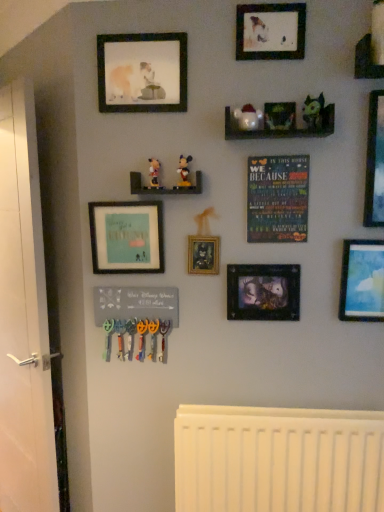
Question: Does matte blue sky at right, which ranks as the sixth picture frame in left-to-right order, turn towards wooden shelf at upper right, the 3th shelf when ordered from left to right?

Choices:
 (A) no
 (B) yes

Answer: (A)

Question: From a real-world perspective, is matte blue sky at right, which ranks as the sixth picture frame in left-to-right order, below wooden shelf at upper right, the 1th shelf viewed from the top?

Choices:
 (A) no
 (B) yes

Answer: (B)

Question: Is matte blue sky at right, which ranks as the sixth picture frame in left-to-right order, shorter than wooden shelf at upper right, the third shelf positioned from the bottom?

Choices:
 (A) yes
 (B) no

Answer: (B)

Question: Does matte blue sky at right, which ranks as the sixth picture frame in left-to-right order, have a greater height compared to wooden shelf at upper right, which is counted as the 1th shelf, starting from the right?

Choices:
 (A) no
 (B) yes

Answer: (B)

Question: Considering the relative sizes of matte blue sky at right, which ranks as the 2th picture frame in right-to-left order, and wooden shelf at upper right, the 3th shelf when ordered from left to right, in the image provided, is matte blue sky at right, which ranks as the 2th picture frame in right-to-left order, wider than wooden shelf at upper right, the 3th shelf when ordered from left to right,?

Choices:
 (A) yes
 (B) no

Answer: (B)

Question: Looking at their shapes, would you say white plastic radiator at lower center is wider or thinner than matte plastic mickey mouse at center, marked as the 1th toy in a left-to-right arrangement?

Choices:
 (A) thin
 (B) wide

Answer: (B)

Question: In the image, is white plastic radiator at lower center positioned in front of or behind matte plastic mickey mouse at center, marked as the 1th toy in a left-to-right arrangement?

Choices:
 (A) front
 (B) behind

Answer: (B)

Question: In terms of size, does white plastic radiator at lower center appear bigger or smaller than matte plastic mickey mouse at center, marked as the 1th toy in a left-to-right arrangement?

Choices:
 (A) small
 (B) big

Answer: (B)

Question: From their relative heights in the image, would you say white plastic radiator at lower center is taller or shorter than matte plastic mickey mouse at center, the fourth toy from the right?

Choices:
 (A) short
 (B) tall

Answer: (B)

Question: Considering the positions of wooden shelf at upper right, the 3th shelf when ordered from left to right, and white plastic radiator at lower center in the image, is wooden shelf at upper right, the 3th shelf when ordered from left to right, wider or thinner than white plastic radiator at lower center?

Choices:
 (A) wide
 (B) thin

Answer: (B)

Question: Considering the positions of point (377, 66) and point (347, 444), is point (377, 66) closer or farther from the camera than point (347, 444)?

Choices:
 (A) closer
 (B) farther

Answer: (A)

Question: Would you say wooden shelf at upper right, the third shelf positioned from the bottom, is to the left or to the right of white plastic radiator at lower center in the picture?

Choices:
 (A) right
 (B) left

Answer: (A)

Question: Relative to white plastic radiator at lower center, is wooden shelf at upper right, which is counted as the 1th shelf, starting from the right, in front or behind?

Choices:
 (A) front
 (B) behind

Answer: (A)

Question: Which is correct: wooden shelf at upper right, the third shelf positioned from the bottom, is inside wooden poster at center, or outside of it?

Choices:
 (A) outside
 (B) inside

Answer: (A)

Question: From their relative heights in the image, would you say wooden shelf at upper right, the third shelf positioned from the bottom, is taller or shorter than wooden poster at center?

Choices:
 (A) tall
 (B) short

Answer: (B)